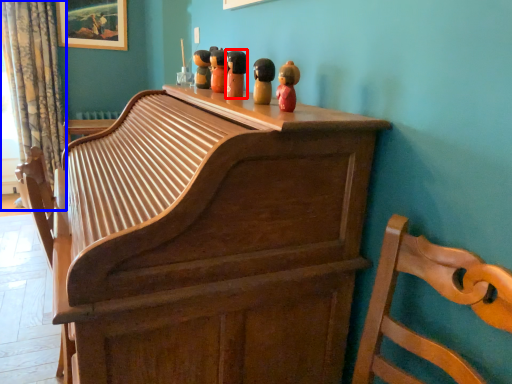
Question: Which point is closer to the camera, toy (highlighted by a red box) or curtain (highlighted by a blue box)?

Choices:
 (A) toy
 (B) curtain

Answer: (A)